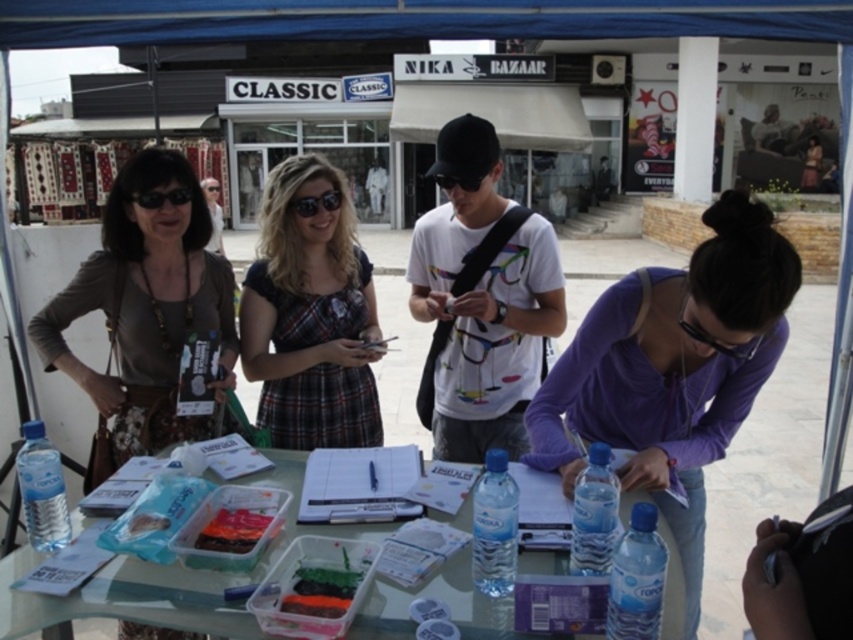
You are standing at the edge of the table looking towards the center. Which of the two points, point (727,307) or point (283,380), is closer to you?

Point (727,307) is closer to the viewer than point (283,380).